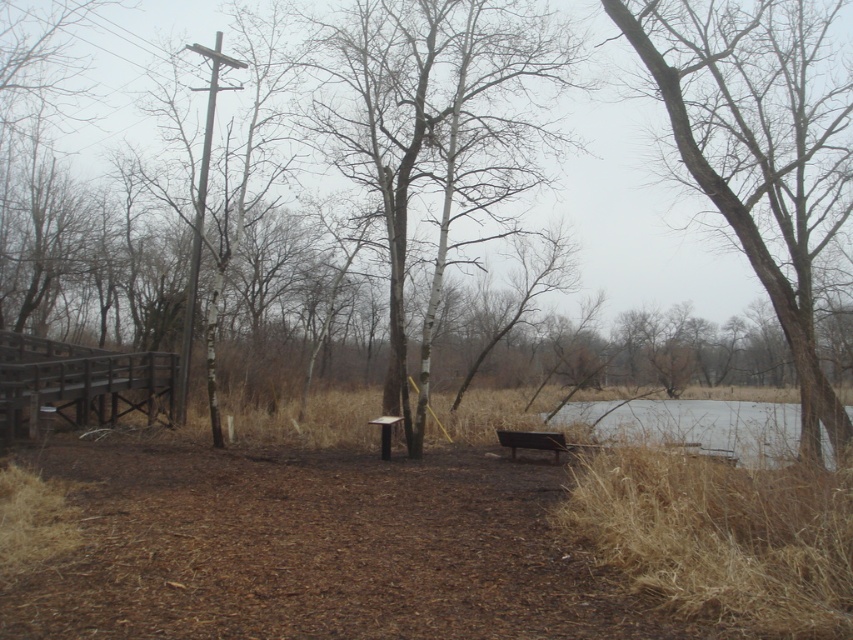
Looking at this image, you are standing on the dirt path and want to walk towards the brown wood tree at center. Which direction should you go to avoid the wooden picnic table at center?

The brown wood tree at center is closer to the viewer than the wooden picnic table at center, so you can walk directly towards the brown wood tree at center without needing to avoid the wooden picnic table at center since it is further back.

You are a hiker who wants to take a photo of the brown wooden bench at center. You need to ensure the brown textured tree at right doesn not block the view. Is the tree taller than the bench?

The brown textured tree at right is taller than the brown wooden bench at center, so it may block the view of the bench in your photo.